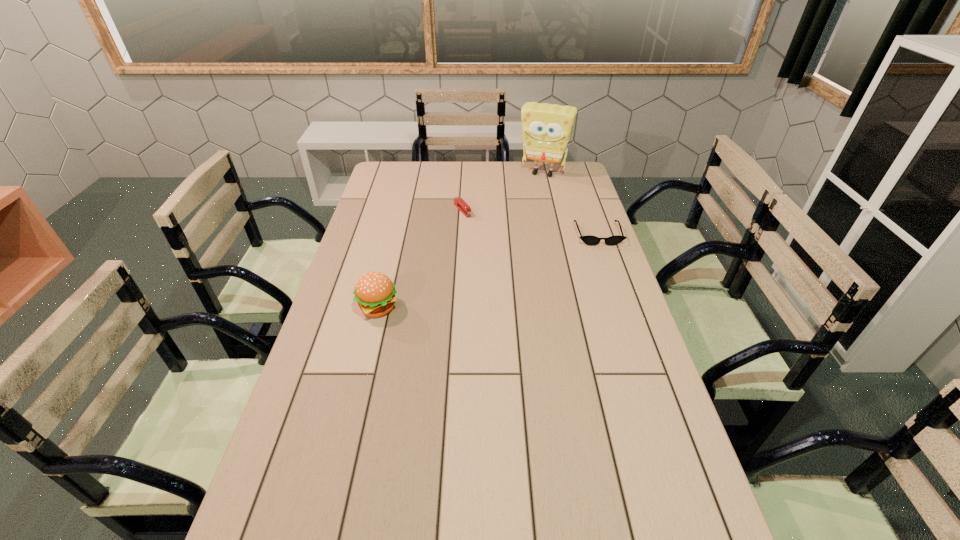
At what (x,y) coordinates should I click in order to perform the action: click on free space at the far edge of the desktop. Please return your answer as a coordinate pair (x, y). The height and width of the screenshot is (540, 960). Looking at the image, I should click on (524, 170).

Locate an element on the screen. Image resolution: width=960 pixels, height=540 pixels. vacant space at the near edge is located at coordinates (451, 533).

Find the location of a particular element. This screenshot has height=540, width=960. free space at the left edge is located at coordinates pyautogui.click(x=396, y=196).

You are a GUI agent. You are given a task and a screenshot of the screen. Output one action in this format:
    pyautogui.click(x=<x>, y=<y>)
    Task: Click on the vacant area at the right edge
    
    Given the screenshot: What is the action you would take?
    pyautogui.click(x=579, y=280)

Where is `vacant area at the far left corner of the desktop`? This screenshot has width=960, height=540. vacant area at the far left corner of the desktop is located at coordinates (407, 168).

In the image, there is a desktop. Where is `blank space at the far right corner`? The width and height of the screenshot is (960, 540). blank space at the far right corner is located at coordinates (570, 167).

Locate an element on the screen. vacant space at the near right corner of the desktop is located at coordinates (698, 509).

This screenshot has height=540, width=960. In order to click on vacant point located between the second nearest object and the leftmost object in this screenshot , I will do `click(488, 271)`.

In order to click on free point between the second nearest object and the second object from left to right in this screenshot , I will do `click(530, 222)`.

In order to click on free space between the second nearest object and the tallest object in this screenshot , I will do `click(570, 204)`.